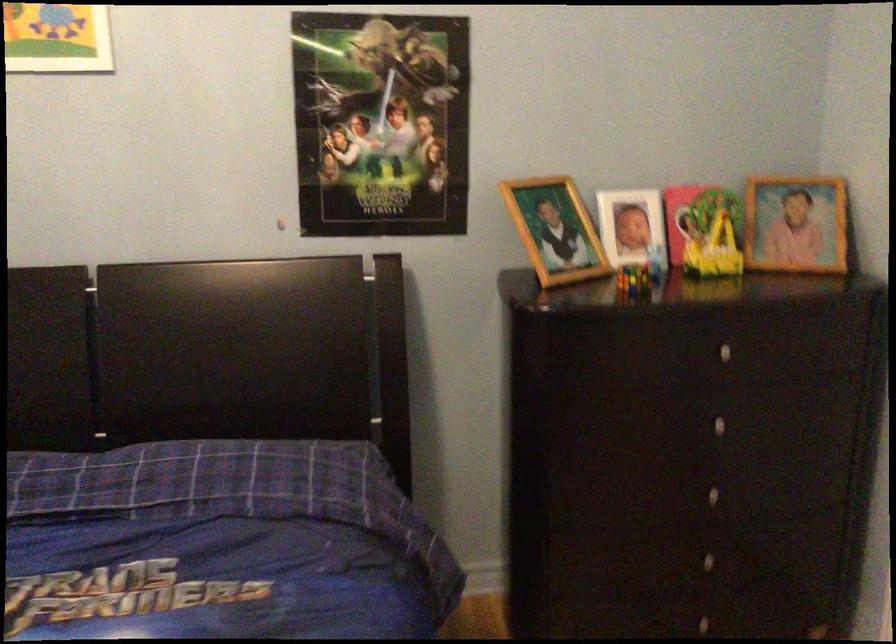
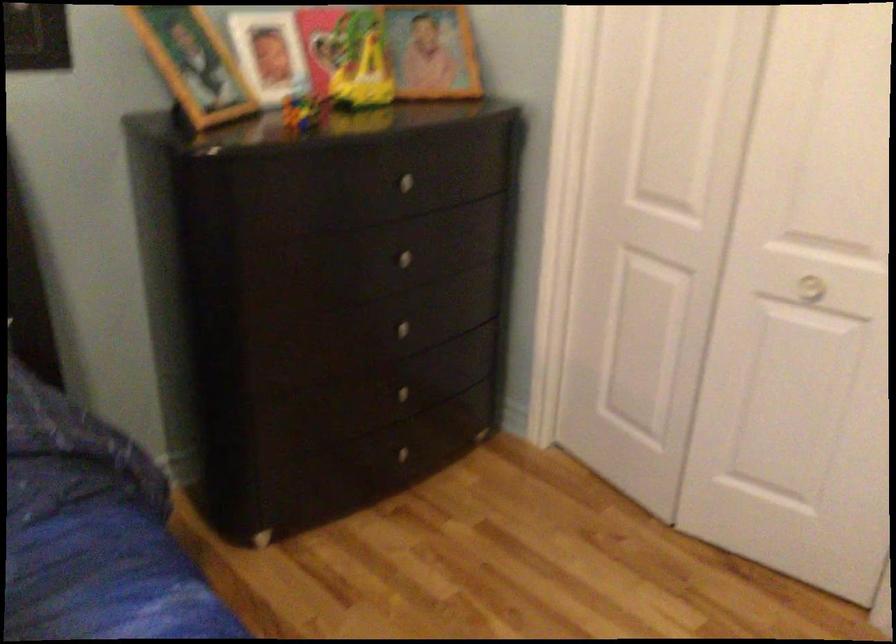
Find the pixel in the second image that matches (633,275) in the first image.

(303, 111)